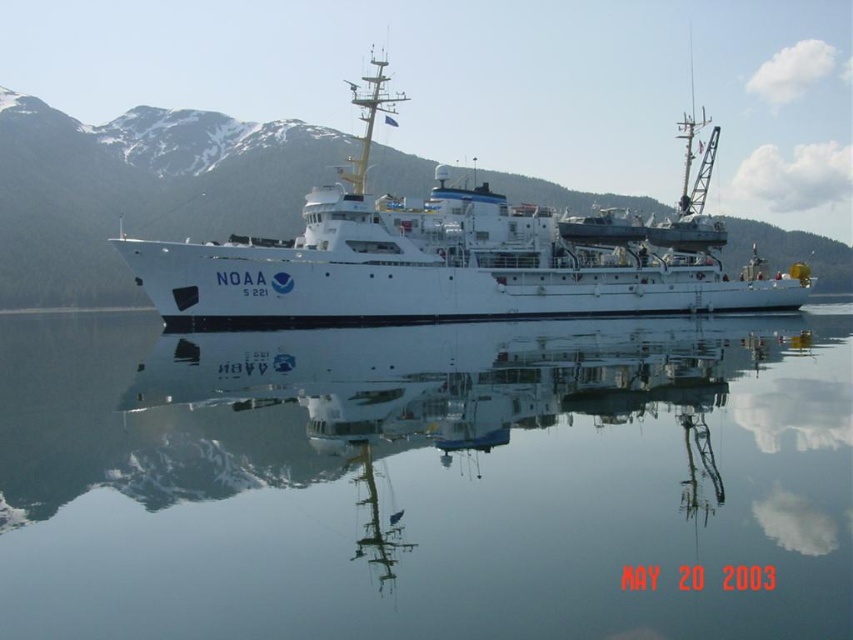
Who is lower down, clear glass water at center or white matte ship at center?

clear glass water at center is lower down.

Is clear glass water at center below white matte ship at center?

Correct, clear glass water at center is located below white matte ship at center.

Is point (149, 614) farther from camera compared to point (160, 264)?

No.

The height and width of the screenshot is (640, 853). Find the location of `clear glass water at center`. clear glass water at center is located at coordinates (427, 481).